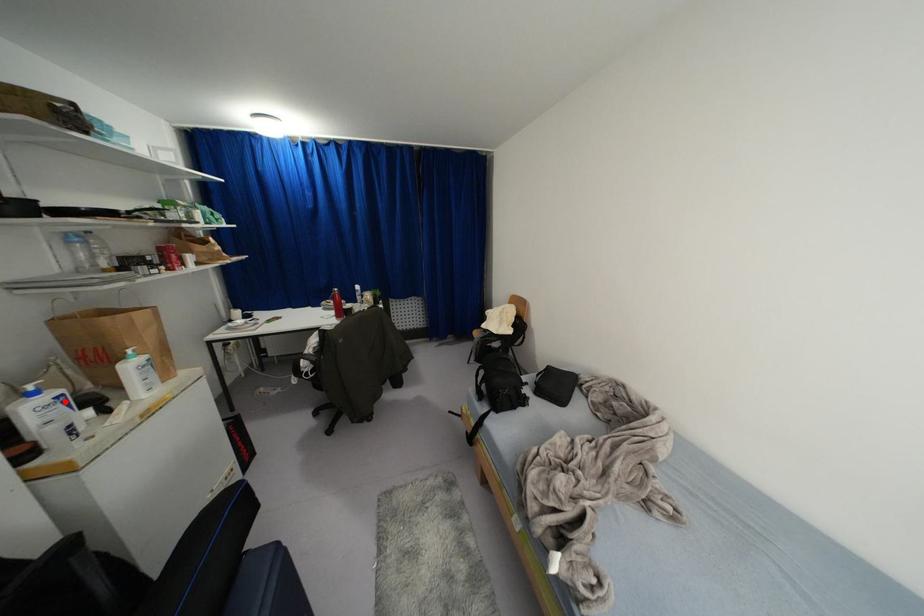
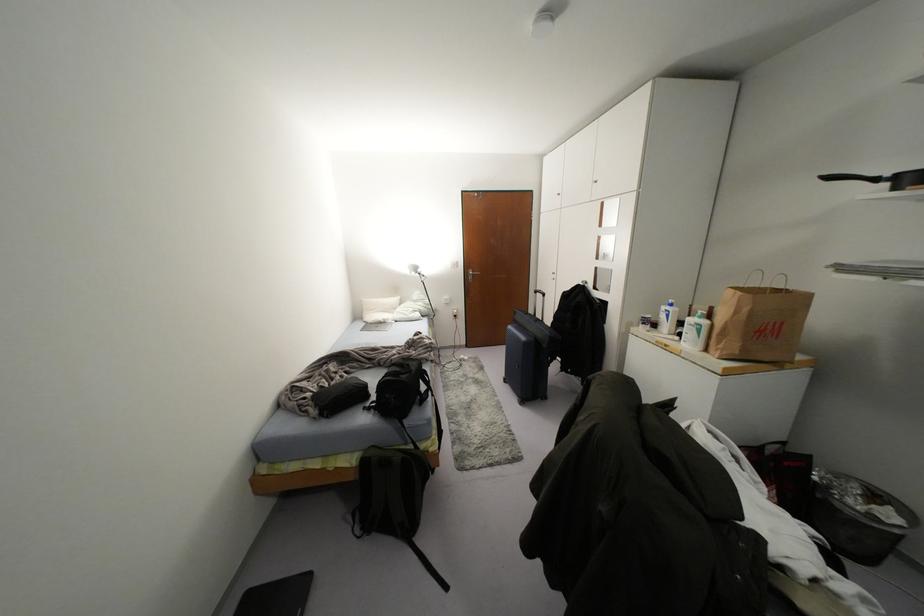
Locate, in the second image, the point that corresponds to the highlighted location in the first image.

(666, 315)